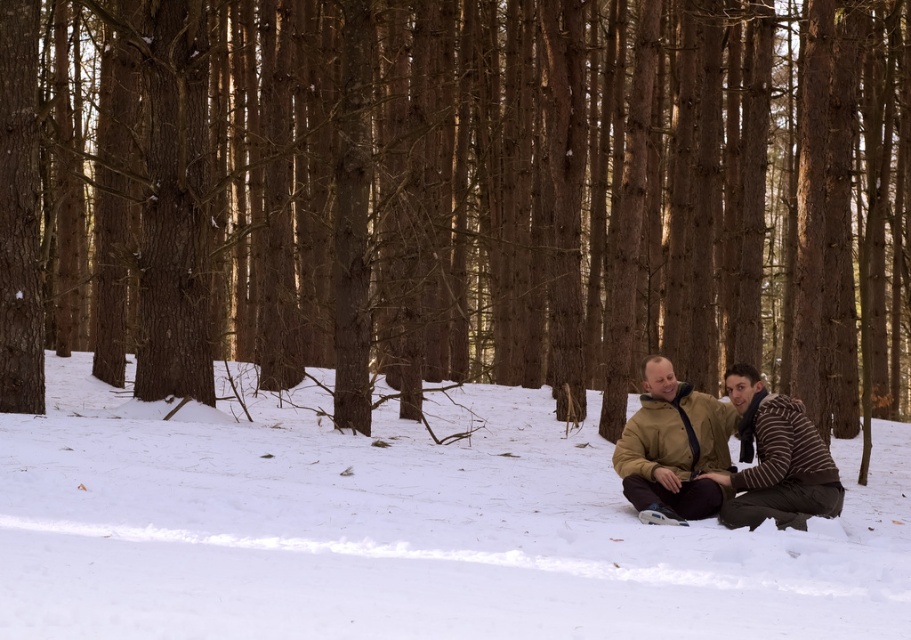
You are planning to take a photo of the brown rough tree at center and the tan leather jacket at center in the winter forest scene. Which object should you focus on first if you want to capture both in a single frame without moving the camera?

The brown rough tree at center is larger in size than the tan leather jacket at center, so you should focus on the brown rough tree at center first to ensure it fits properly in the frame before adjusting for the smaller tan leather jacket at center.

You are standing in the forest and want to take a photo of both the brown rough tree at center and the tan leather jacket at center. Which object should you focus on first to ensure both are in the frame?

You should focus on the brown rough tree at center first because it is closer to you than the tan leather jacket at center, ensuring both are in the frame when focused properly.

You are standing in the forest and want to take a photo of the white fluffy snow at center. Where should you aim your camera to capture it?

The white fluffy snow at center is located at the 2D coordinates of point (404, 531), so you should aim your camera there to capture it.